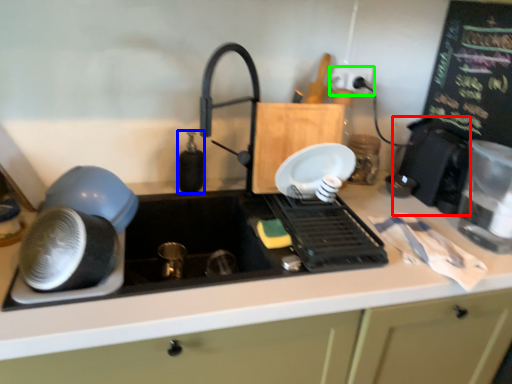
Question: Which object is positioned closest to appliance (highlighted by a red box)? Select from bottle (highlighted by a blue box) and electric outlet (highlighted by a green box).

Choices:
 (A) bottle
 (B) electric outlet

Answer: (B)